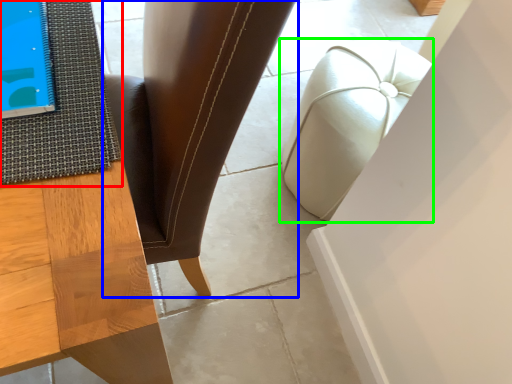
Question: Which object is the closest to the mat (highlighted by a red box)? Choose among these: chair (highlighted by a blue box) or furniture (highlighted by a green box).

Choices:
 (A) chair
 (B) furniture

Answer: (A)